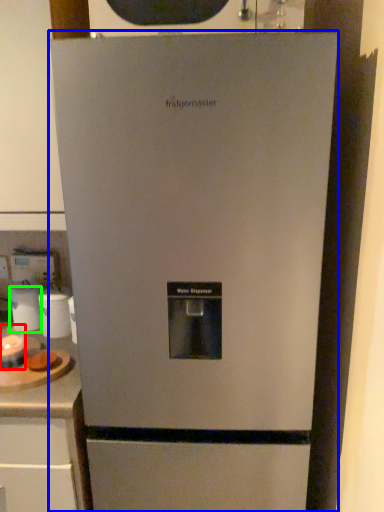
Question: Which is farther away from appliance (highlighted by a red box)? refrigerator (highlighted by a blue box) or appliance (highlighted by a green box)?

Choices:
 (A) refrigerator
 (B) appliance

Answer: (A)